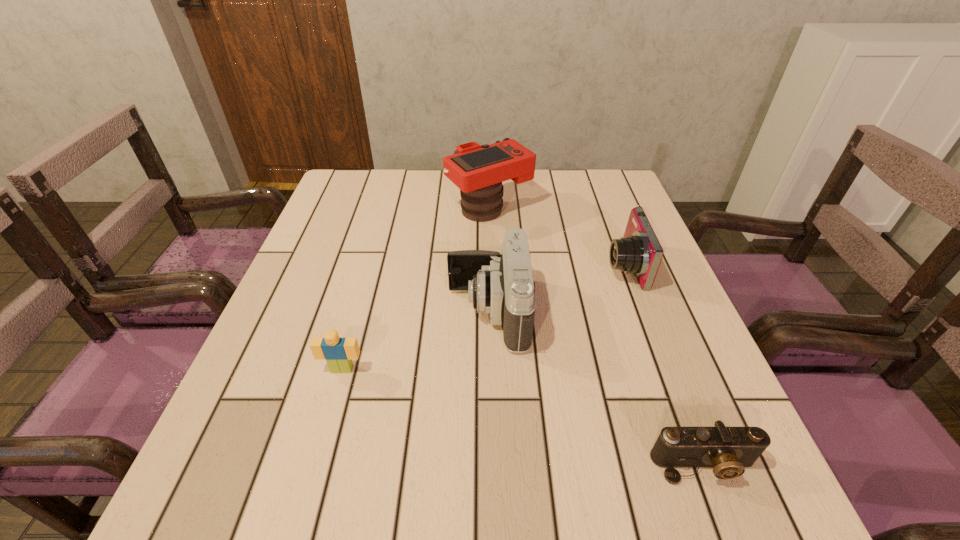
Locate an element on the screen. The height and width of the screenshot is (540, 960). free space at the near left corner is located at coordinates (280, 498).

In the image, there is a desktop. At what (x,y) coordinates should I click in order to perform the action: click on free space at the far right corner. Please return your answer as a coordinate pair (x, y). The image size is (960, 540). Looking at the image, I should click on (580, 174).

In the image, there is a desktop. Where is `blank space at the near right corner`? The width and height of the screenshot is (960, 540). blank space at the near right corner is located at coordinates (715, 493).

In order to click on vacant area that lies between the farthest object and the leftmost object in this screenshot , I will do `click(416, 288)`.

The height and width of the screenshot is (540, 960). I want to click on blank region between the farthest camera and the Lego, so click(x=416, y=288).

Where is `vacant area that lies between the shortest object and the farthest camera`? The image size is (960, 540). vacant area that lies between the shortest object and the farthest camera is located at coordinates (596, 337).

You are a GUI agent. You are given a task and a screenshot of the screen. Output one action in this format:
    pyautogui.click(x=<x>, y=<y>)
    Task: Click on the free space between the third tallest camera and the farthest camera
    The height and width of the screenshot is (540, 960).
    Given the screenshot: What is the action you would take?
    pyautogui.click(x=556, y=237)

The image size is (960, 540). Identify the location of vacant space in between the farthest camera and the third tallest camera. (556, 237).

Identify which object is the third closest to the shortest camera. Please provide its 2D coordinates. Your answer should be formatted as a tuple, i.e. [(x, y)], where the tuple contains the x and y coordinates of a point satisfying the conditions above.

[(339, 352)]

This screenshot has height=540, width=960. Find the location of `the fourth closest object relative to the shortest camera`. the fourth closest object relative to the shortest camera is located at coordinates (478, 171).